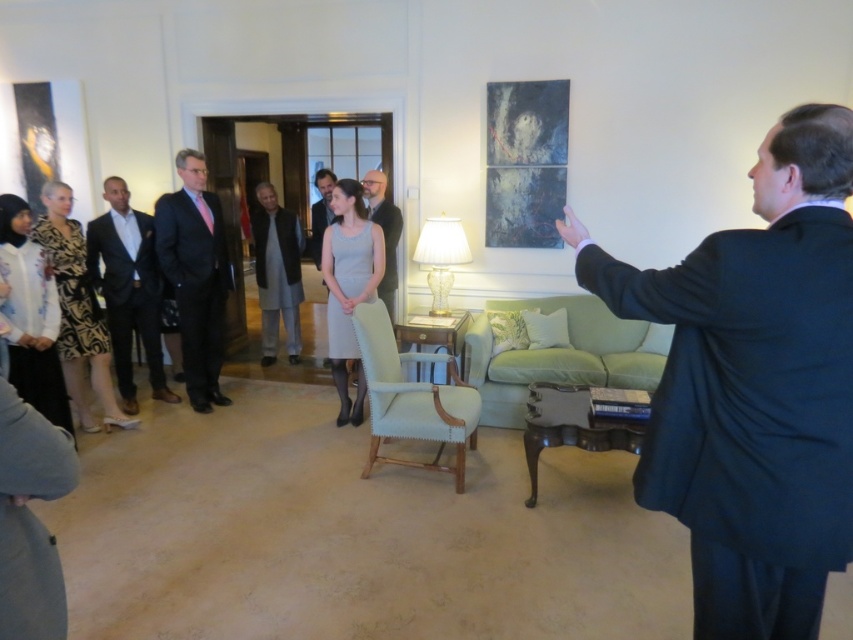
Does white satin dress at lower left have a larger size compared to light brown leather jacket at center?

Actually, white satin dress at lower left might be smaller than light brown leather jacket at center.

What do you see at coordinates (32, 316) in the screenshot?
I see `white satin dress at lower left` at bounding box center [32, 316].

Find the location of a particular element. Image resolution: width=853 pixels, height=640 pixels. white satin dress at lower left is located at coordinates (32, 316).

The height and width of the screenshot is (640, 853). Identify the location of white satin dress at lower left. (32, 316).

Is matte black suit at center shorter than light brown leather jacket at center?

In fact, matte black suit at center may be taller than light brown leather jacket at center.

Which of these two, matte black suit at center or light brown leather jacket at center, stands shorter?

light brown leather jacket at center

What do you see at coordinates (384, 232) in the screenshot? Image resolution: width=853 pixels, height=640 pixels. I see `matte black suit at center` at bounding box center [384, 232].

The width and height of the screenshot is (853, 640). In order to click on matte black suit at center in this screenshot , I will do `click(384, 232)`.

Does dark suit at left have a larger size compared to matte black suit at center?

Indeed, dark suit at left has a larger size compared to matte black suit at center.

You are a GUI agent. You are given a task and a screenshot of the screen. Output one action in this format:
    pyautogui.click(x=<x>, y=<y>)
    Task: Click on the dark suit at left
    Image resolution: width=853 pixels, height=640 pixels.
    Given the screenshot: What is the action you would take?
    pyautogui.click(x=128, y=289)

Who is more forward, (117, 307) or (378, 220)?

Point (117, 307) is in front.

This screenshot has height=640, width=853. I want to click on dark suit at left, so click(x=128, y=289).